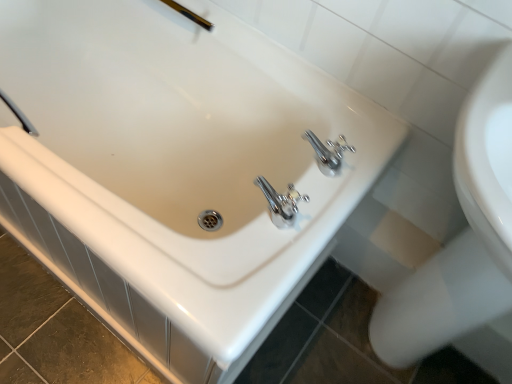
I want to click on empty space that is ontop of white glossy bidet at lower right (from a real-world perspective), so click(398, 239).